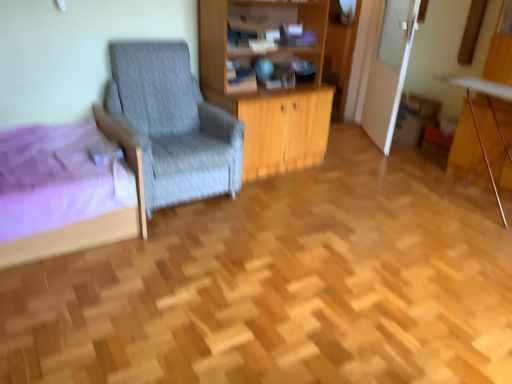
This screenshot has width=512, height=384. I want to click on free space between gray fabric chair at left and wooden desk at right, so click(x=345, y=196).